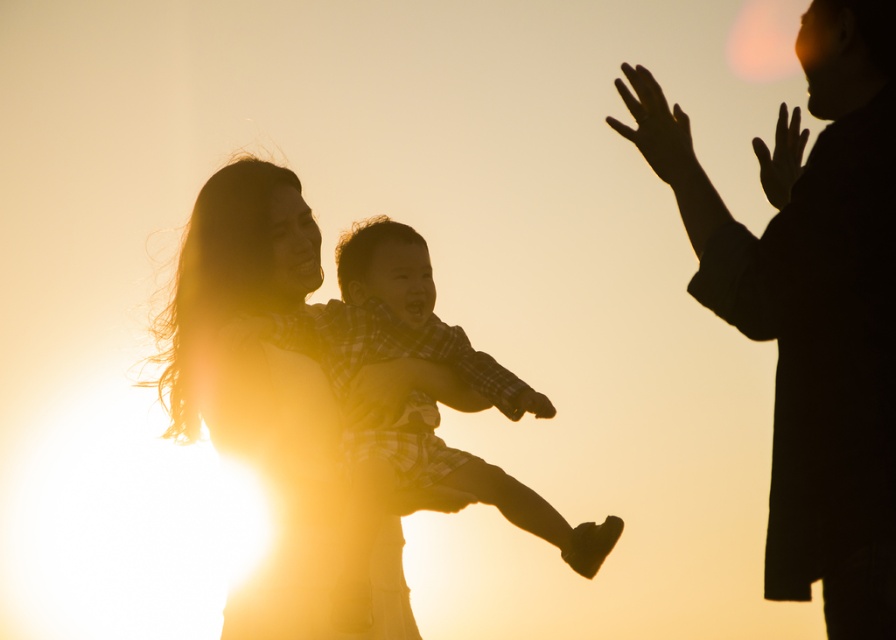
You are a photographer trying to capture a candid moment of the black matte coat at right and the silky skin hand at upper right. Your camera has a lens that can focus on objects within a 12 inch range. Can you capture both in the same frame without moving the camera?

The black matte coat at right and silky skin hand at upper right are 13.27 inches apart, which is slightly beyond the camera lens range of 12 inches. Therefore, you cannot capture both in the same frame without moving the camera.

You are a fashion designer observing the golden hour scene. You notice the black matte coat at right and the silhouette dress at center. Which clothing item appears bigger in the image?

The black matte coat at right has a larger size compared to the silhouette dress at center, so the black matte coat at right appears bigger in the image.